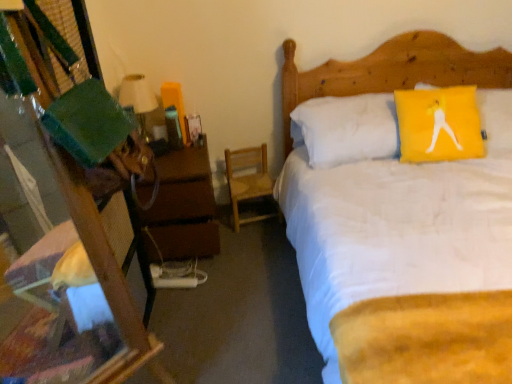
Question: From the image's perspective, relative to matte white lampshade at left, is wooden desk at left above or below?

Choices:
 (A) above
 (B) below

Answer: (B)

Question: Considering the positions of wooden desk at left and matte white lampshade at left in the image, is wooden desk at left bigger or smaller than matte white lampshade at left?

Choices:
 (A) big
 (B) small

Answer: (A)

Question: Estimate the real-world distances between objects in this image. Which object is farther from the wooden chair at center?

Choices:
 (A) wooden desk at left
 (B) brown wooden nightstand at left
 (C) white soft bed at upper right
 (D) matte white lampshade at left

Answer: (A)

Question: Which is nearer to the wooden chair at center?

Choices:
 (A) matte white lampshade at left
 (B) brown wooden nightstand at left
 (C) wooden desk at left
 (D) white soft bed at upper right

Answer: (B)